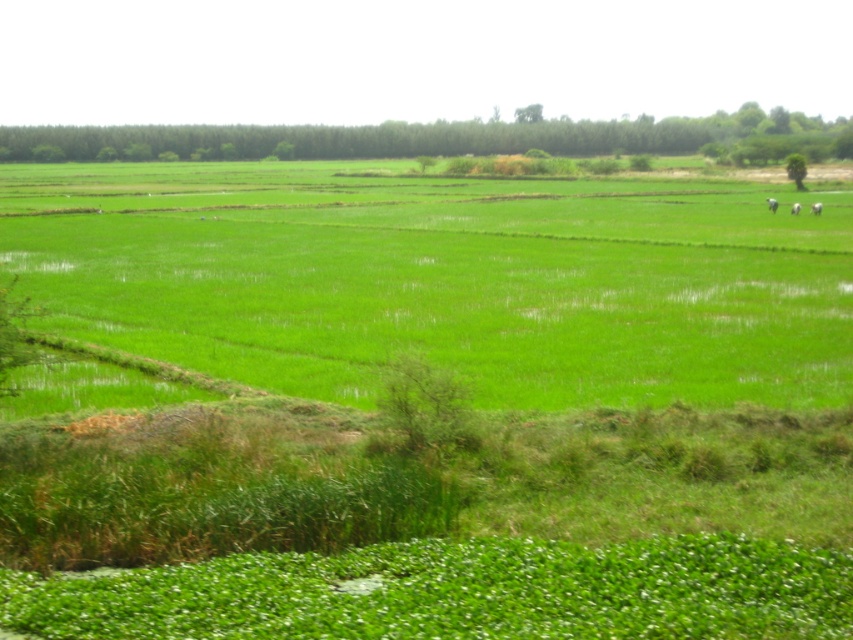
Can you confirm if green grass at center is taller than white fluffy sheep at upper right?

Correct, green grass at center is much taller as white fluffy sheep at upper right.

Is green grass at center smaller than white fluffy sheep at upper right?

No.

Between point (370, 356) and point (770, 196), which one is positioned in front?

Point (370, 356)

Locate an element on the screen. The height and width of the screenshot is (640, 853). green grass at center is located at coordinates (445, 280).

This screenshot has width=853, height=640. What do you see at coordinates (770, 204) in the screenshot?
I see `white fluffy sheep at upper right` at bounding box center [770, 204].

Can you confirm if white fluffy sheep at upper right is bigger than white woolen sheep at right?

No.

Does point (770, 200) lie behind point (813, 211)?

Yes.

The height and width of the screenshot is (640, 853). I want to click on white fluffy sheep at upper right, so click(x=770, y=204).

Does white fluffy sheep at upper right appear on the right side of white fluffy cow at upper right?

In fact, white fluffy sheep at upper right is to the left of white fluffy cow at upper right.

Who is more distant from viewer, (769,209) or (791,212)?

Positioned behind is point (769,209).

This screenshot has width=853, height=640. Find the location of `white fluffy sheep at upper right`. white fluffy sheep at upper right is located at coordinates click(x=770, y=204).